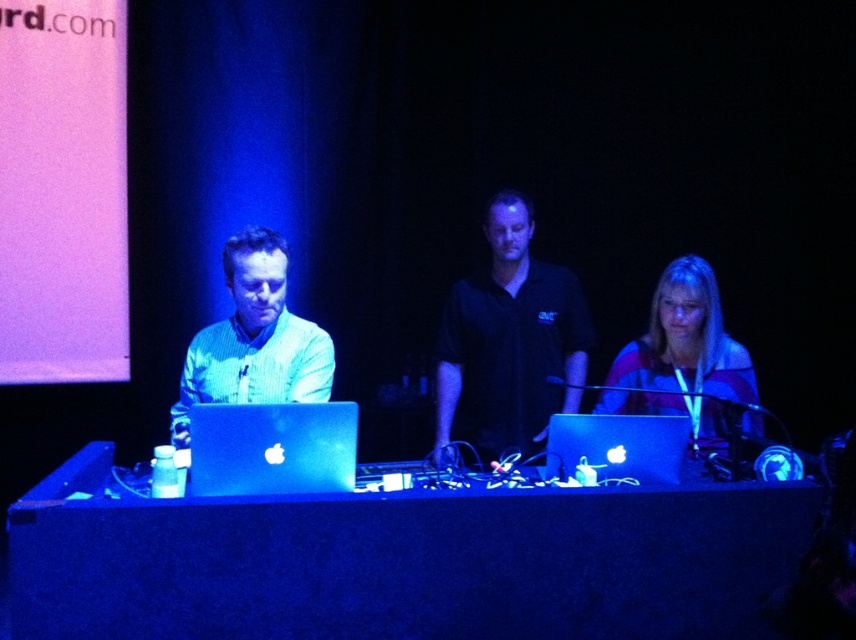
The height and width of the screenshot is (640, 856). Describe the element at coordinates (510, 339) in the screenshot. I see `black matte shirt at center` at that location.

Locate an element on the screen. This screenshot has width=856, height=640. black matte shirt at center is located at coordinates (510, 339).

The image size is (856, 640). What are the coordinates of `black matte shirt at center` in the screenshot? It's located at (510, 339).

Consider the image. Is black matte shirt at center to the left of striped fabric shirt at center from the viewer's perspective?

Yes, black matte shirt at center is to the left of striped fabric shirt at center.

Which is more to the left, black matte shirt at center or striped fabric shirt at center?

From the viewer's perspective, black matte shirt at center appears more on the left side.

At what (x,y) coordinates should I click in order to perform the action: click on black matte shirt at center. Please return your answer as a coordinate pair (x, y). This screenshot has width=856, height=640. Looking at the image, I should click on (510, 339).

What are the coordinates of `black matte shirt at center` in the screenshot? It's located at (510, 339).

Is black matte shirt at center wider than green matte shirt at center?

Indeed, black matte shirt at center has a greater width compared to green matte shirt at center.

At what (x,y) coordinates should I click in order to perform the action: click on black matte shirt at center. Please return your answer as a coordinate pair (x, y). Looking at the image, I should click on (510, 339).